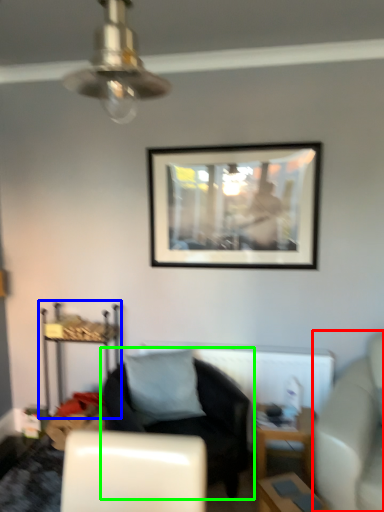
Question: Estimate the real-world distances between objects in this image. Which object is closer to studio couch (highlighted by a red box), dresser (highlighted by a blue box) or chair (highlighted by a green box)?

Choices:
 (A) dresser
 (B) chair

Answer: (B)